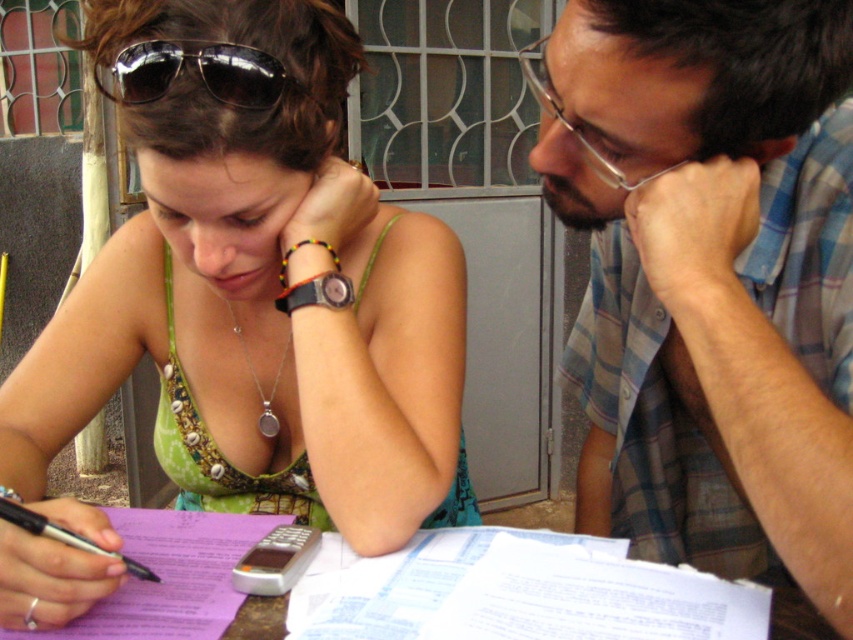
Is point (538, 38) less distant than point (93, 552)?

No, (538, 38) is further to viewer.

Does clear plastic glasses at upper right have a lesser width compared to black plastic pen at lower left?

Indeed, clear plastic glasses at upper right has a lesser width compared to black plastic pen at lower left.

You are a GUI agent. You are given a task and a screenshot of the screen. Output one action in this format:
    pyautogui.click(x=<x>, y=<y>)
    Task: Click on the clear plastic glasses at upper right
    This screenshot has width=853, height=640.
    Given the screenshot: What is the action you would take?
    pyautogui.click(x=575, y=124)

In order to click on clear plastic glasses at upper right in this screenshot , I will do `click(575, 124)`.

Who is lower down, purple paper at center or silver metallic phone at center?

purple paper at center is below.

Does purple paper at center have a greater height compared to silver metallic phone at center?

Yes.

Image resolution: width=853 pixels, height=640 pixels. What do you see at coordinates (529, 593) in the screenshot? I see `purple paper at center` at bounding box center [529, 593].

At what (x,y) coordinates should I click in order to perform the action: click on purple paper at center. Please return your answer as a coordinate pair (x, y). Image resolution: width=853 pixels, height=640 pixels. Looking at the image, I should click on coord(529,593).

Does green fabric dress at center have a larger size compared to purple paper at center?

Yes, green fabric dress at center is bigger than purple paper at center.

Is green fabric dress at center taller than purple paper at center?

Yes, green fabric dress at center is taller than purple paper at center.

Is point (155, 198) positioned after point (631, 600)?

Yes, it is.

What are the coordinates of `green fabric dress at center` in the screenshot? It's located at (254, 289).